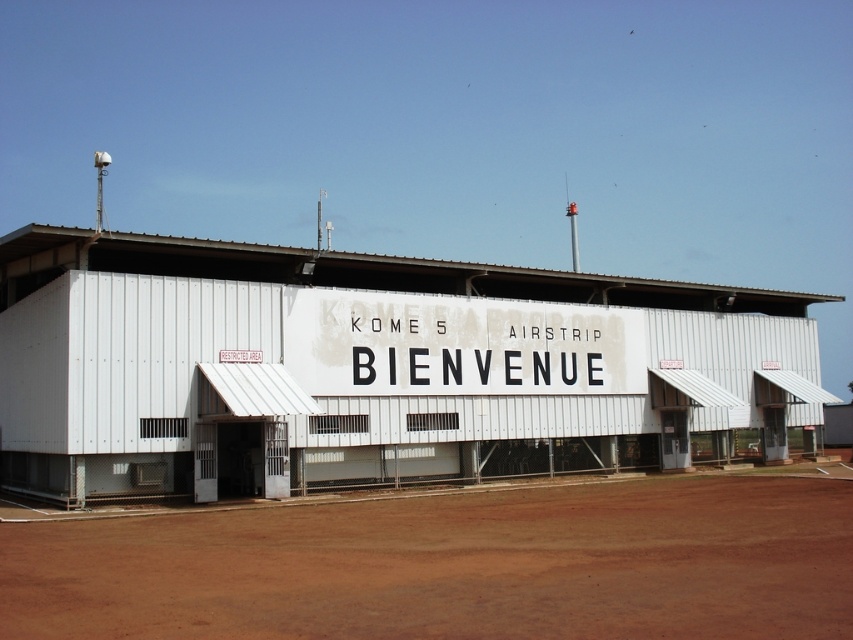
You are a delivery drone that needs to land on the brown dirt field at lower center. The minimum safe distance required for landing is 10 meters. Can you safely land on the field if you are currently above the white corrugated metal shed at center?

The white corrugated metal shed at center and brown dirt field at lower center are 12.07 meters apart from each other. Since the minimum safe distance is 10 meters, the drone can safely land on the brown dirt field at lower center as the distance is sufficient.